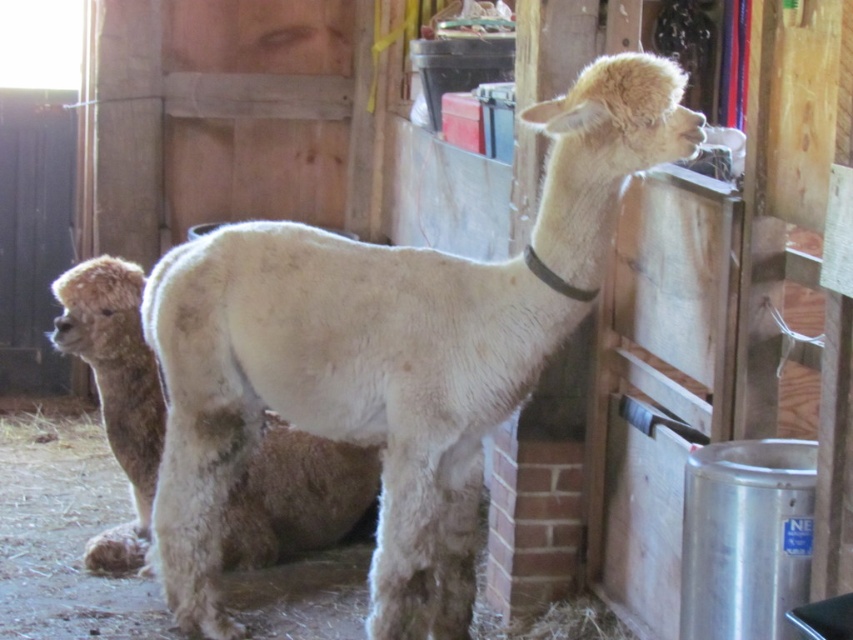
Question: Does white woolen alpaca at center appear over fuzzy white alpaca at center?

Choices:
 (A) yes
 (B) no

Answer: (A)

Question: Which object is farther from the camera taking this photo?

Choices:
 (A) white woolen alpaca at center
 (B) fuzzy white alpaca at center

Answer: (B)

Question: Can you confirm if white woolen alpaca at center is positioned above fuzzy white alpaca at center?

Choices:
 (A) no
 (B) yes

Answer: (B)

Question: Which object appears closest to the camera in this image?

Choices:
 (A) white woolen alpaca at center
 (B) fuzzy white alpaca at center

Answer: (A)

Question: Where is white woolen alpaca at center located in relation to fuzzy white alpaca at center in the image?

Choices:
 (A) below
 (B) above

Answer: (B)